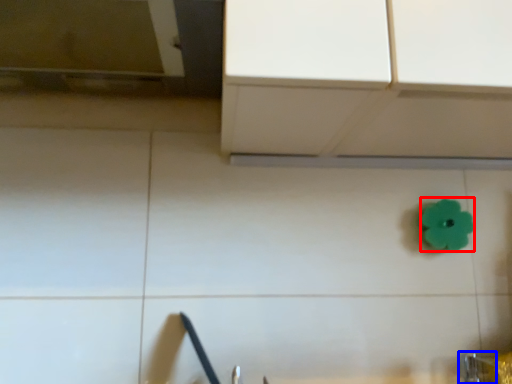
Question: Among these objects, which one is nearest to the camera, flower (highlighted by a red box) or faucet (highlighted by a blue box)?

Choices:
 (A) flower
 (B) faucet

Answer: (B)